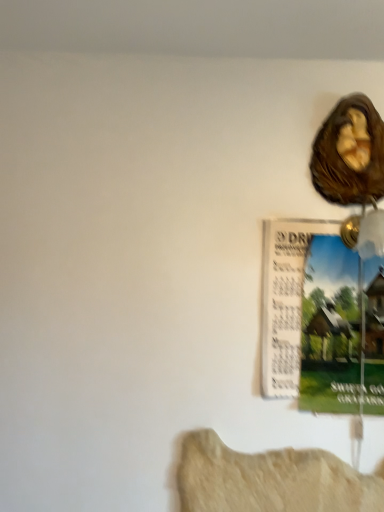
Question: In the image, is brown textured shell at upper right on the left side or the right side of matte paper poster at upper right?

Choices:
 (A) left
 (B) right

Answer: (B)

Question: From the image's perspective, relative to matte paper poster at upper right, is brown textured shell at upper right above or below?

Choices:
 (A) below
 (B) above

Answer: (B)

Question: In the image, is brown textured shell at upper right positioned in front of or behind matte paper poster at upper right?

Choices:
 (A) front
 (B) behind

Answer: (B)

Question: Looking at their shapes, would you say matte paper poster at upper right is wider or thinner than brown textured shell at upper right?

Choices:
 (A) thin
 (B) wide

Answer: (A)

Question: From a real-world perspective, is matte paper poster at upper right above or below brown textured shell at upper right?

Choices:
 (A) above
 (B) below

Answer: (B)

Question: Considering their positions, is matte paper poster at upper right located in front of or behind brown textured shell at upper right?

Choices:
 (A) front
 (B) behind

Answer: (A)

Question: Based on their sizes in the image, would you say matte paper poster at upper right is bigger or smaller than brown textured shell at upper right?

Choices:
 (A) big
 (B) small

Answer: (A)